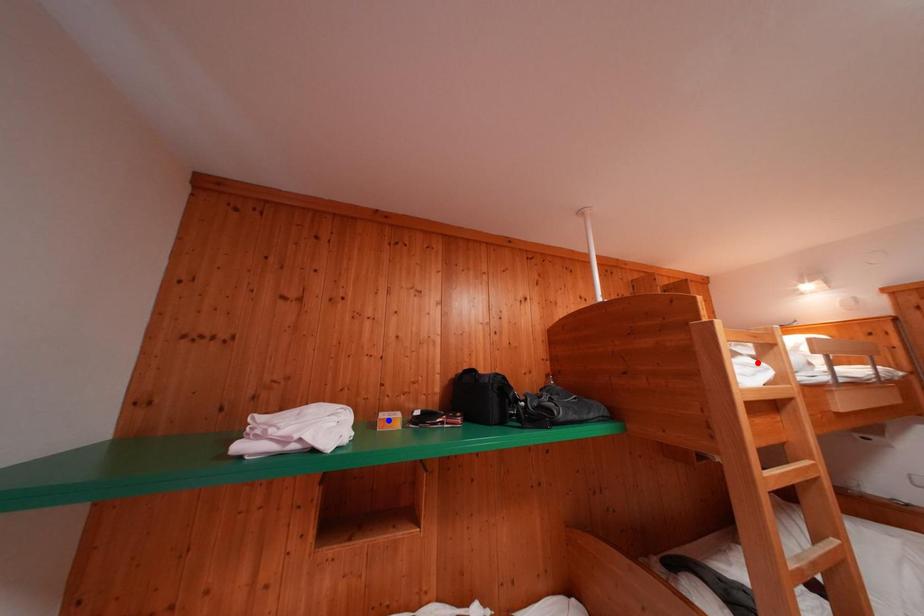
Question: Two points are marked on the image. Which point is closer to the camera?

Choices:
 (A) Blue point is closer.
 (B) Red point is closer.

Answer: (B)